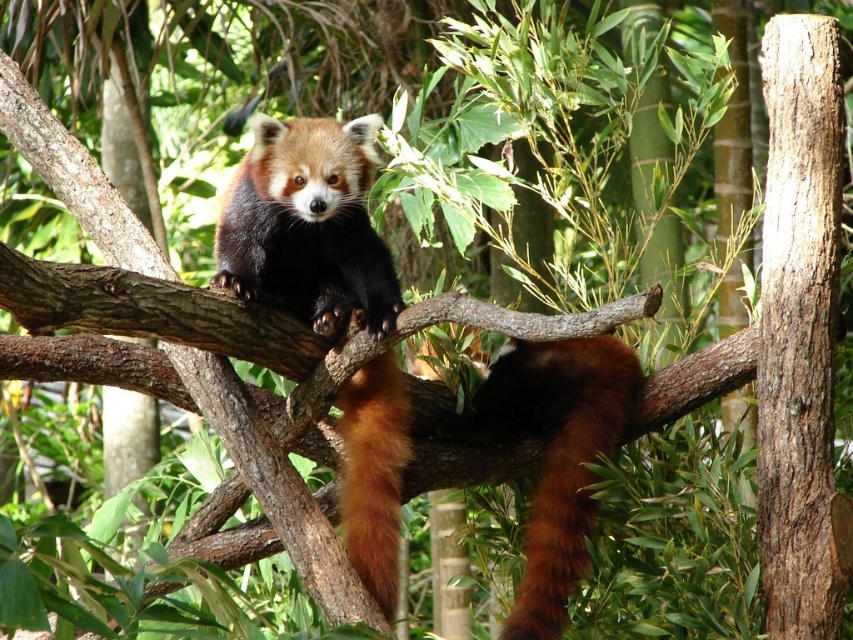
You are observing a red panda in a forest. There are two points marked in the image. The first point is at coordinates point (296, 310) and the second point is at point (316, 147). Which point is closer to the red panda?

Point (316, 147) is closer to the red panda because it is in front of point (296, 310), which is behind it.

You are observing a red panda in its natural habitat. You notice a specific point in the image marked as point (x=306, y=225). What is located at this point?

At point (x=306, y=225) lies fluffy brown red fur at center.